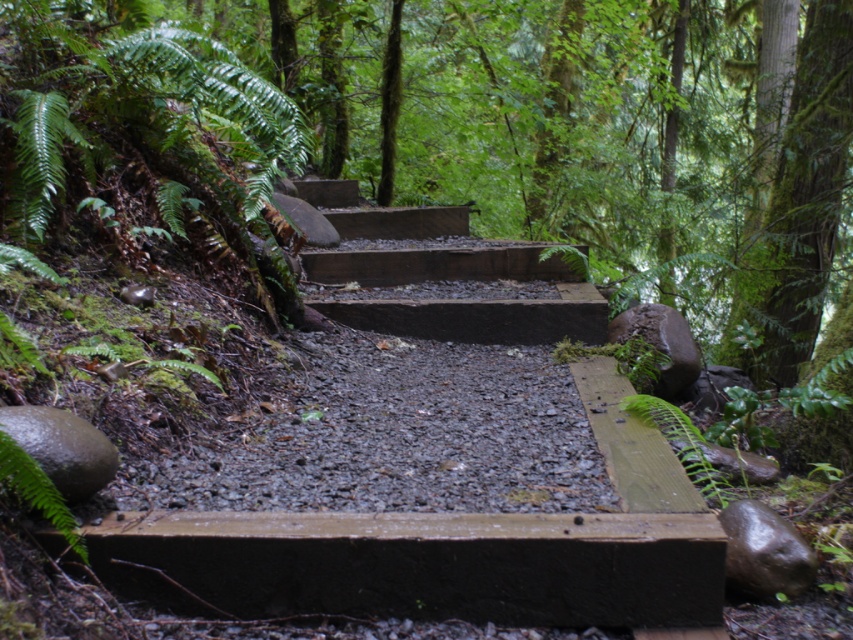
Question: Can you confirm if brown wooden stairs at center is positioned to the right of green matte fern at lower left?

Choices:
 (A) no
 (B) yes

Answer: (B)

Question: Observing the image, what is the correct spatial positioning of brown wooden stairs at center in reference to green matte fern at lower left?

Choices:
 (A) left
 (B) right

Answer: (B)

Question: Among these objects, which one is nearest to the camera?

Choices:
 (A) green matte fern at lower left
 (B) brown wooden stairs at center

Answer: (A)

Question: Which point is closer to the camera?

Choices:
 (A) green matte fern at lower left
 (B) brown wooden stairs at center

Answer: (A)

Question: Can you confirm if brown wooden stairs at center is positioned above green matte fern at lower left?

Choices:
 (A) yes
 (B) no

Answer: (A)